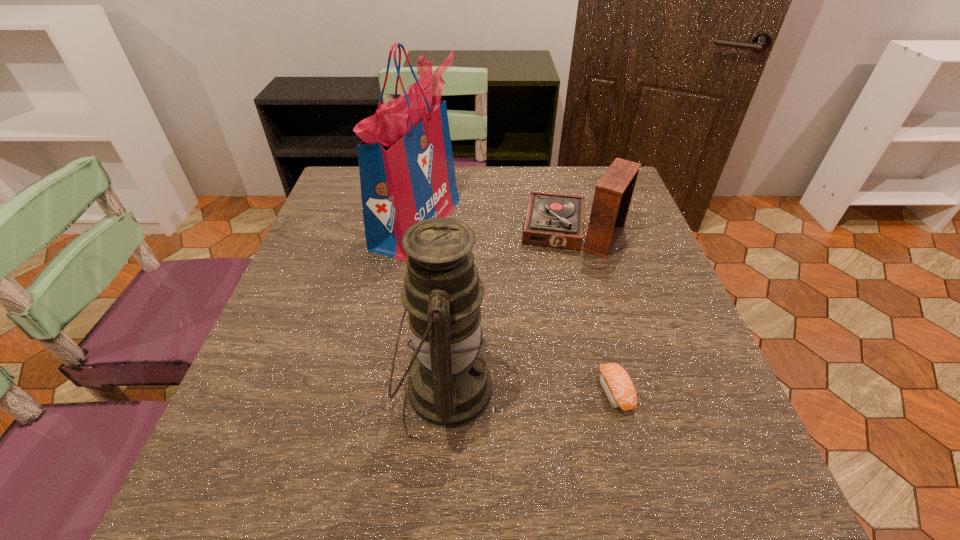
This screenshot has width=960, height=540. Find the location of `vacant area in the image that satisfies the following two spatial constraints: 1. on the back side of the third tallest object; 2. on the front-facing side of the grocery bag`. vacant area in the image that satisfies the following two spatial constraints: 1. on the back side of the third tallest object; 2. on the front-facing side of the grocery bag is located at coordinates (571, 223).

Image resolution: width=960 pixels, height=540 pixels. In order to click on free space in the image that satisfies the following two spatial constraints: 1. on the front-facing side of the oil lamp; 2. on the left side of the tallest object in this screenshot , I will do `click(388, 389)`.

At what (x,y) coordinates should I click in order to perform the action: click on free space that satisfies the following two spatial constraints: 1. on the front-facing side of the third shortest object; 2. on the right side of the grocery bag. Please return your answer as a coordinate pair (x, y). Image resolution: width=960 pixels, height=540 pixels. Looking at the image, I should click on (388, 389).